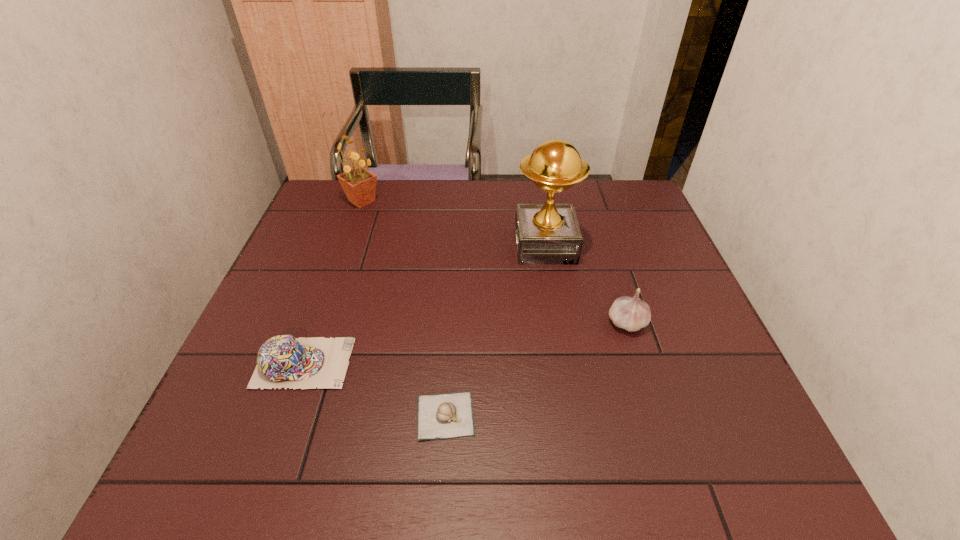
I want to click on vacant region between the fourth tallest object and the left garlic, so click(x=374, y=389).

Locate an element on the screen. free space between the cap and the second farthest object is located at coordinates (424, 304).

Find the location of a particular element. unoccupied area between the fourth shortest object and the second farthest object is located at coordinates (453, 223).

Locate an element on the screen. The height and width of the screenshot is (540, 960). blank region between the nearest object and the rightmost object is located at coordinates (537, 369).

Find the location of a particular element. vacant space in between the second shortest object and the sunflower is located at coordinates (333, 282).

At what (x,y) coordinates should I click in order to perform the action: click on vacant area between the right garlic and the nearer garlic. Please return your answer as a coordinate pair (x, y). The width and height of the screenshot is (960, 540). Looking at the image, I should click on (537, 369).

You are a GUI agent. You are given a task and a screenshot of the screen. Output one action in this format:
    pyautogui.click(x=<x>, y=<y>)
    Task: Click on the vacant space in between the shorter garlic and the third tallest object
    
    Given the screenshot: What is the action you would take?
    pyautogui.click(x=537, y=369)

Where is `free space between the left garlic and the cap`? The width and height of the screenshot is (960, 540). free space between the left garlic and the cap is located at coordinates [374, 389].

I want to click on free space between the shortest object and the rightmost object, so [537, 369].

Where is `free point between the shortest object and the second nearest object`? The width and height of the screenshot is (960, 540). free point between the shortest object and the second nearest object is located at coordinates (374, 389).